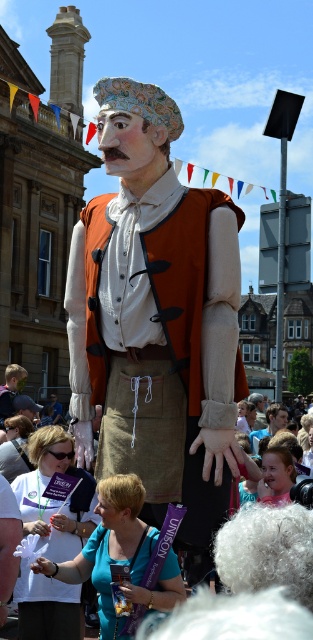
Question: Estimate the real-world distances between objects in this image. Which object is farther from the matte orange vest at center?

Choices:
 (A) white fabric at center
 (B) blue fabric at lower center

Answer: (B)

Question: Can you confirm if matte orange vest at center is positioned below white fabric at center?

Choices:
 (A) yes
 (B) no

Answer: (B)

Question: Estimate the real-world distances between objects in this image. Which object is closer to the blue fabric at lower center?

Choices:
 (A) white fabric at center
 (B) matte orange vest at center

Answer: (A)

Question: Estimate the real-world distances between objects in this image. Which object is farther from the blue fabric at lower center?

Choices:
 (A) matte orange vest at center
 (B) white fabric at center

Answer: (A)

Question: Can you confirm if matte orange vest at center is positioned below blue fabric at lower center?

Choices:
 (A) no
 (B) yes

Answer: (A)

Question: Is matte orange vest at center bigger than white fabric at center?

Choices:
 (A) no
 (B) yes

Answer: (B)